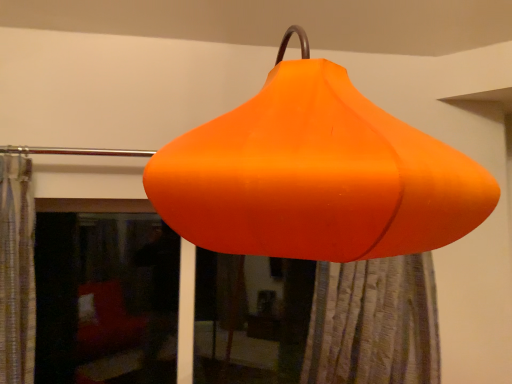
Question: In which direction should I rotate to look at orange fabric shower curtain at lower center?

Choices:
 (A) left
 (B) right

Answer: (B)

Question: From a real-world perspective, is transparent glass window at lower left positioned over orange fabric shower curtain at lower center based on gravity?

Choices:
 (A) yes
 (B) no

Answer: (A)

Question: Is transparent glass window at lower left facing away from orange fabric shower curtain at lower center?

Choices:
 (A) yes
 (B) no

Answer: (B)

Question: From the image's perspective, would you say transparent glass window at lower left is shown under orange fabric shower curtain at lower center?

Choices:
 (A) no
 (B) yes

Answer: (A)

Question: Does transparent glass window at lower left touch orange fabric shower curtain at lower center?

Choices:
 (A) no
 (B) yes

Answer: (A)

Question: Is transparent glass window at lower left aimed at orange fabric shower curtain at lower center?

Choices:
 (A) yes
 (B) no

Answer: (B)

Question: From the image's perspective, is transparent glass window at lower left on orange fabric shower curtain at lower center?

Choices:
 (A) yes
 (B) no

Answer: (A)

Question: Can you confirm if orange matte lampshade at center is taller than transparent glass window at lower left?

Choices:
 (A) no
 (B) yes

Answer: (B)

Question: Is orange matte lampshade at center turned away from transparent glass window at lower left?

Choices:
 (A) no
 (B) yes

Answer: (A)

Question: Is transparent glass window at lower left located within orange matte lampshade at center?

Choices:
 (A) yes
 (B) no

Answer: (B)

Question: Can you confirm if orange matte lampshade at center is bigger than transparent glass window at lower left?

Choices:
 (A) no
 (B) yes

Answer: (B)

Question: From a real-world perspective, is orange matte lampshade at center under transparent glass window at lower left?

Choices:
 (A) no
 (B) yes

Answer: (A)

Question: Is the depth of orange matte lampshade at center less than that of transparent glass window at lower left?

Choices:
 (A) no
 (B) yes

Answer: (B)

Question: Considering the relative sizes of transparent glass window at lower left and orange matte lampshade at center in the image provided, is transparent glass window at lower left wider than orange matte lampshade at center?

Choices:
 (A) no
 (B) yes

Answer: (A)